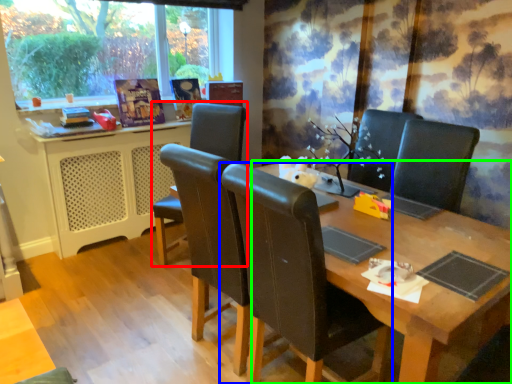
Question: Which object is the closest to the chair (highlighted by a red box)? Choose among these: chair (highlighted by a blue box) or table (highlighted by a green box).

Choices:
 (A) chair
 (B) table

Answer: (A)